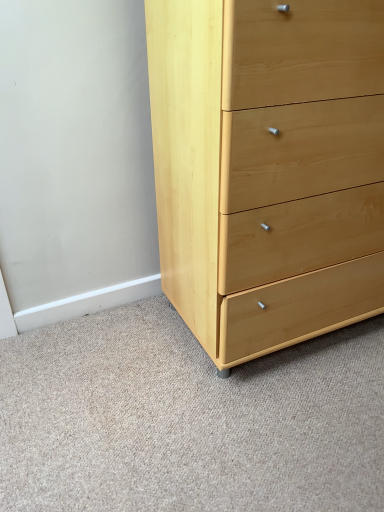
Question: Is point (311, 108) positioned closer to the camera than point (86, 421)?

Choices:
 (A) farther
 (B) closer

Answer: (B)

Question: In the image, is natural wood chest of drawers at center positioned in front of or behind light wood drawer at lower right?

Choices:
 (A) front
 (B) behind

Answer: (B)

Question: Is natural wood chest of drawers at center wider or thinner than light wood drawer at lower right?

Choices:
 (A) wide
 (B) thin

Answer: (B)

Question: Would you say light wood drawer at lower right is to the left or to the right of natural wood chest of drawers at center in the picture?

Choices:
 (A) right
 (B) left

Answer: (B)

Question: Based on their sizes in the image, would you say light wood drawer at lower right is bigger or smaller than natural wood chest of drawers at center?

Choices:
 (A) small
 (B) big

Answer: (A)

Question: Is light wood drawer at lower right spatially inside natural wood chest of drawers at center, or outside of it?

Choices:
 (A) inside
 (B) outside

Answer: (B)

Question: Is point (119, 328) positioned closer to the camera than point (311, 214)?

Choices:
 (A) farther
 (B) closer

Answer: (A)